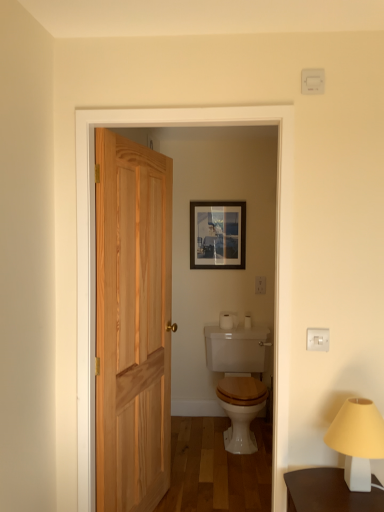
Find the location of `free space in front of white glossy toilet at center`. free space in front of white glossy toilet at center is located at coordinates (225, 475).